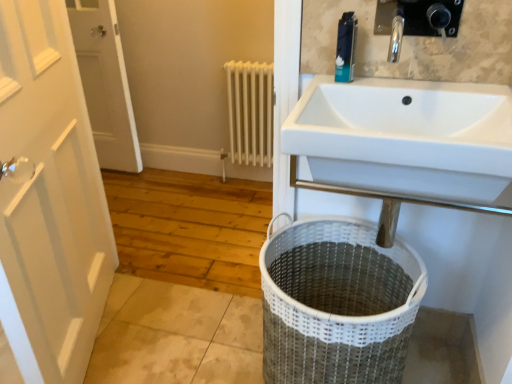
Locate an element on the screen. The image size is (512, 384). free region under white wooden door at left, the second door in the back-to-front sequence (from a real-world perspective) is located at coordinates (106, 329).